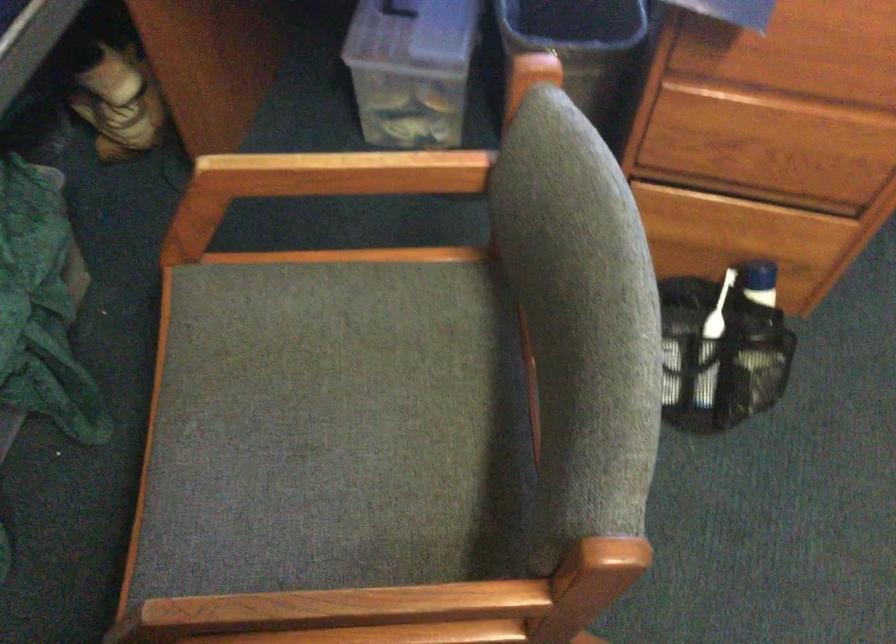
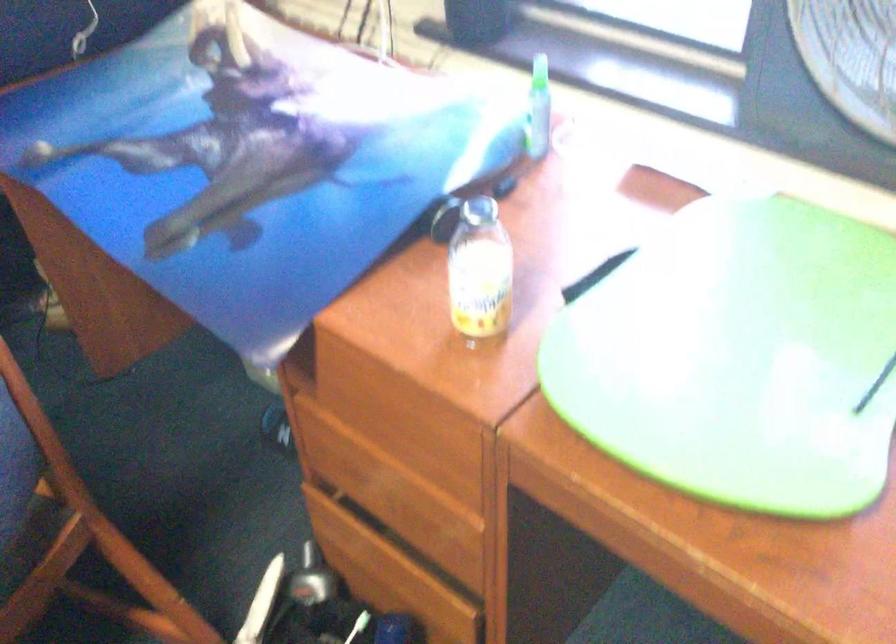
Question: I am providing you with two images of the same scene from different viewpoints. Please identify which objects are invisible in image2.

Choices:
 (A) small glass bottle
 (B) chair sitting surface
 (C) grey button panel
 (D) black trash can

Answer: (D)